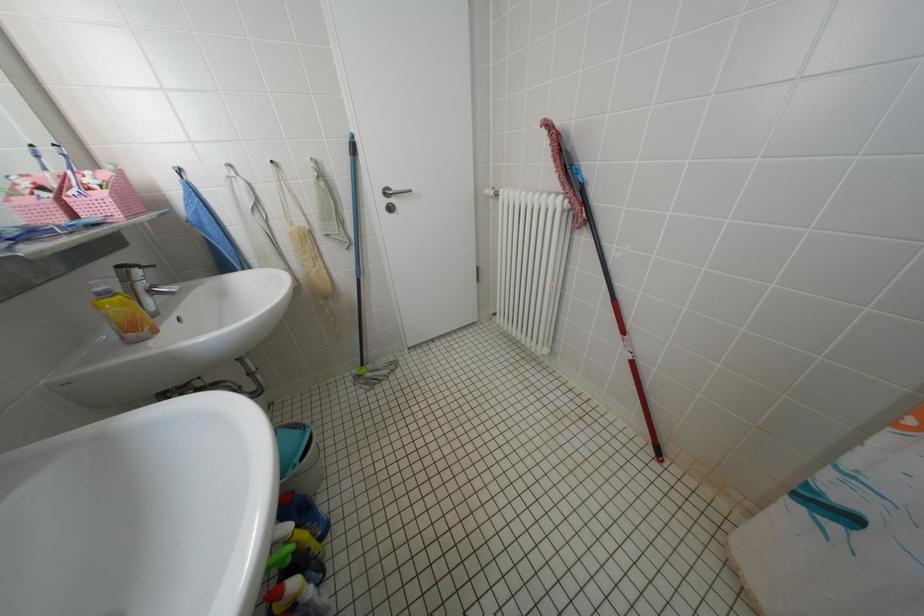
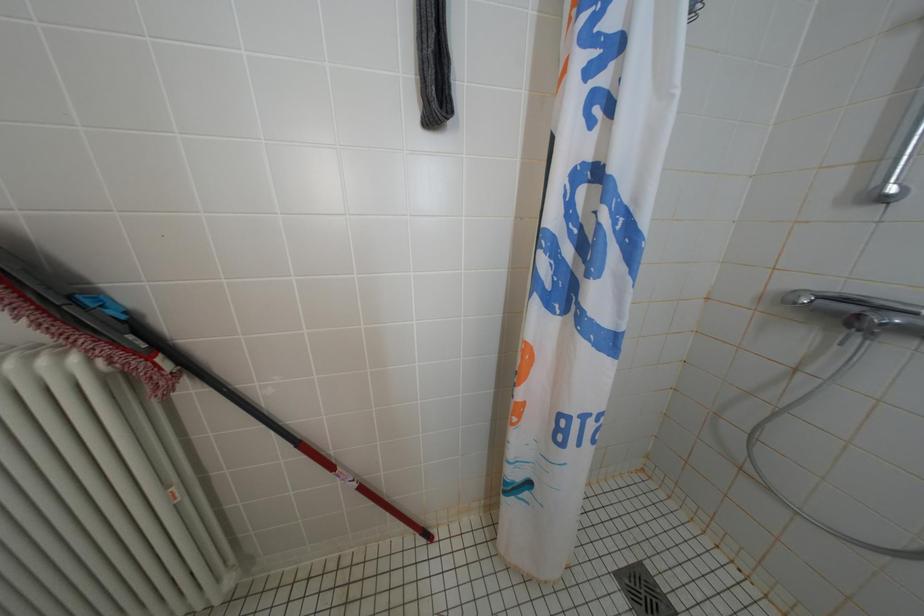
Question: The camera is either moving clockwise (left) or counter-clockwise (right) around the object. The first image is from the beginning of the video and the second image is from the end. Is the camera moving left or right when shooting the video?

Choices:
 (A) Left
 (B) Right

Answer: (A)